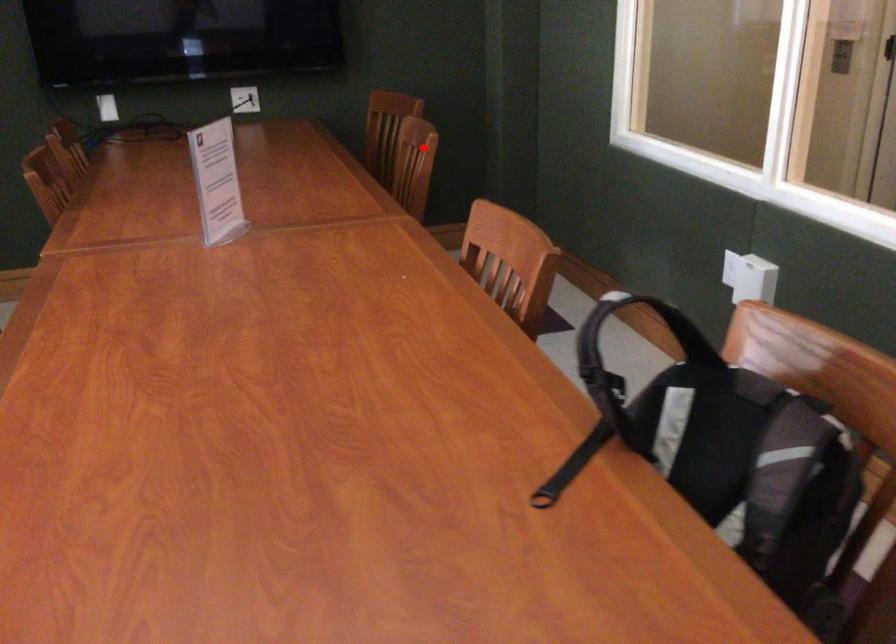
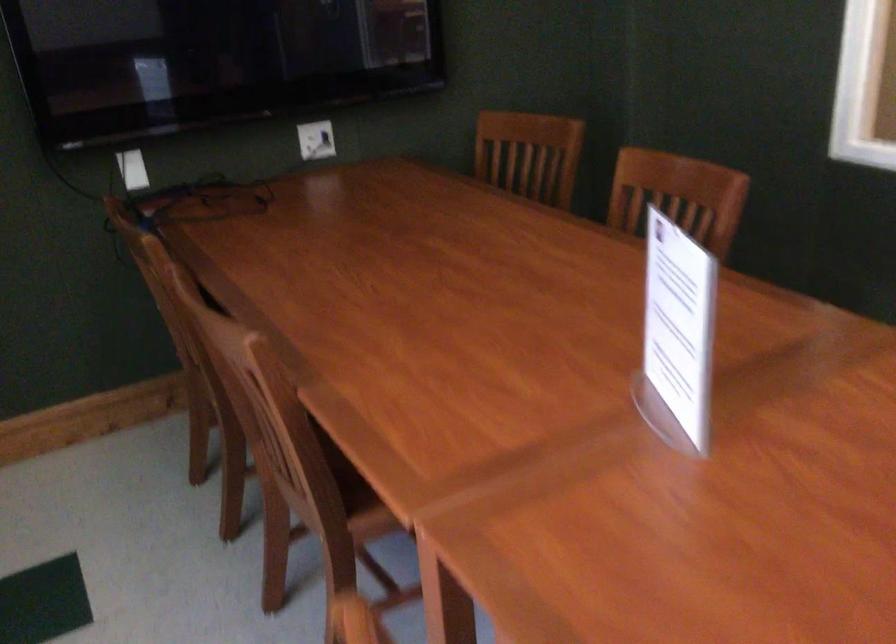
Find the pixel in the second image that matches the highlighted location in the first image.

(677, 196)